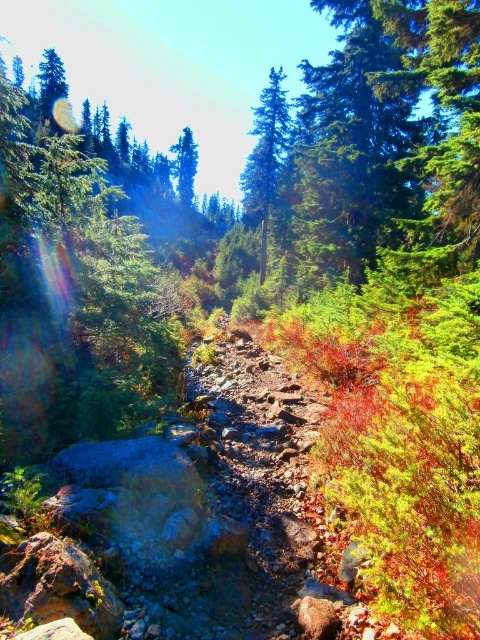
Which of these two, green matte tree at center or green matte tree at upper center, stands taller?

Standing taller between the two is green matte tree at upper center.

Does green matte tree at center appear on the left side of green matte tree at upper center?

No, green matte tree at center is not to the left of green matte tree at upper center.

Is point (268, 168) more distant than point (188, 202)?

That is False.

This screenshot has height=640, width=480. I want to click on green matte tree at center, so click(x=265, y=157).